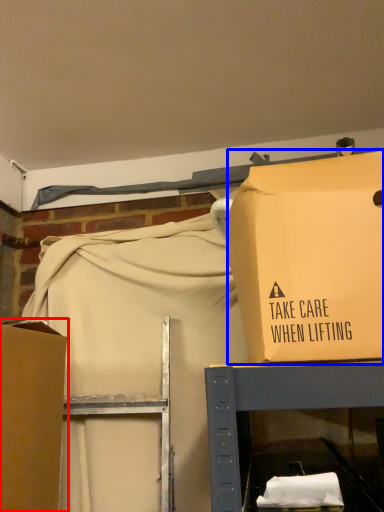
Question: Which object appears closest to the camera in this image, box (highlighted by a red box) or box (highlighted by a blue box)?

Choices:
 (A) box
 (B) box

Answer: (B)